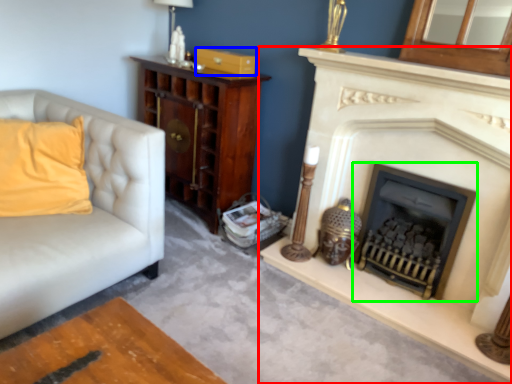
Question: Which is nearer to the fireplace (highlighted by a red box)? drawer (highlighted by a blue box) or wood burning stove (highlighted by a green box).

Choices:
 (A) drawer
 (B) wood burning stove

Answer: (B)